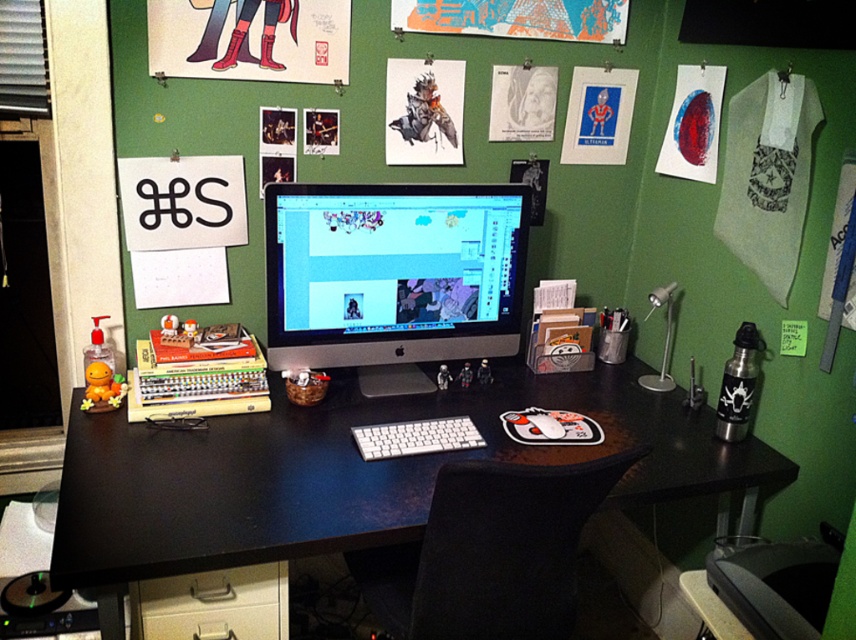
You are setting up a new monitor and want to place it to the left of your existing desk. Based on the image, is there enough space between the black matte computer desk at center and the satin silver monitor at center to move the monitor to the left?

The black matte computer desk at center is already to the right of the satin silver monitor at center, so moving the monitor to the left would require space to its left. However, the description only states their relative positions, not the available space. Without knowing the desk size or clearance, it is uncertain if there is enough space.

You are setting up a new keyboard for your computer. The keyboard you have is 8 inches wide. You want to place it on the black matte computer desk at center so that it doesn t interfere with the mouse already there. Can the white plastic keyboard at center fit on the desk without overlapping the mouse?

The distance between the black matte computer desk at center and the white plastic keyboard at center is 8.67 inches. Since the keyboard is 8 inches wide, there is enough space for it to fit without overlapping the mouse.

You need to place a new wireless mouse on your desk. The mouse requires a specific amount of space to operate. Given the size of the black matte computer desk at center and the white plastic keyboard at center, do you think there is enough space to accommodate the mouse comfortably?

The black matte computer desk at center has a larger size compared to white plastic keyboard at center, so there should be sufficient space to place the new wireless mouse comfortably on the desk.